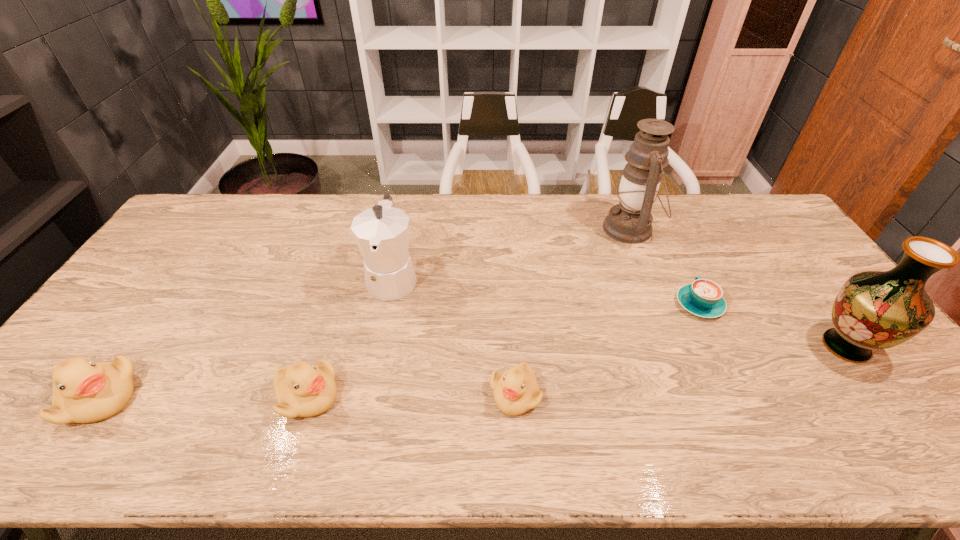
You are a GUI agent. You are given a task and a screenshot of the screen. Output one action in this format:
    pyautogui.click(x=<x>, y=<y>)
    Task: Click on the free space located on the front-facing side of the leftmost object
    The height and width of the screenshot is (540, 960).
    Given the screenshot: What is the action you would take?
    pyautogui.click(x=272, y=399)

I want to click on free region located 0.070m on the front-facing side of the second duckling from left to right, so click(368, 396).

You are a GUI agent. You are given a task and a screenshot of the screen. Output one action in this format:
    pyautogui.click(x=<x>, y=<y>)
    Task: Click on the vacant area situated 0.180m on the front of the oil lamp
    The height and width of the screenshot is (540, 960).
    Given the screenshot: What is the action you would take?
    pyautogui.click(x=655, y=292)

Locate an element on the screen. Image resolution: width=960 pixels, height=540 pixels. free space located 0.070m with the handle on the right side of the cappuccino is located at coordinates (684, 272).

I want to click on blank space located 0.260m with the handle on the right side of the cappuccino, so coord(665,234).

At what (x,y) coordinates should I click in order to perform the action: click on vacant space situated with the handle on the right side of the cappuccino. Please return your answer as a coordinate pair (x, y). This screenshot has height=540, width=960. Looking at the image, I should click on pyautogui.click(x=686, y=276).

This screenshot has width=960, height=540. What are the coordinates of `free location located 0.110m at the spout of the coffeepot` in the screenshot? It's located at (380, 340).

This screenshot has height=540, width=960. Find the location of `vacant region located 0.070m on the back of the vase`. vacant region located 0.070m on the back of the vase is located at coordinates (813, 303).

The height and width of the screenshot is (540, 960). Find the location of `object located at the far edge`. object located at the far edge is located at coordinates (630, 221).

I want to click on object at the left edge, so click(x=84, y=391).